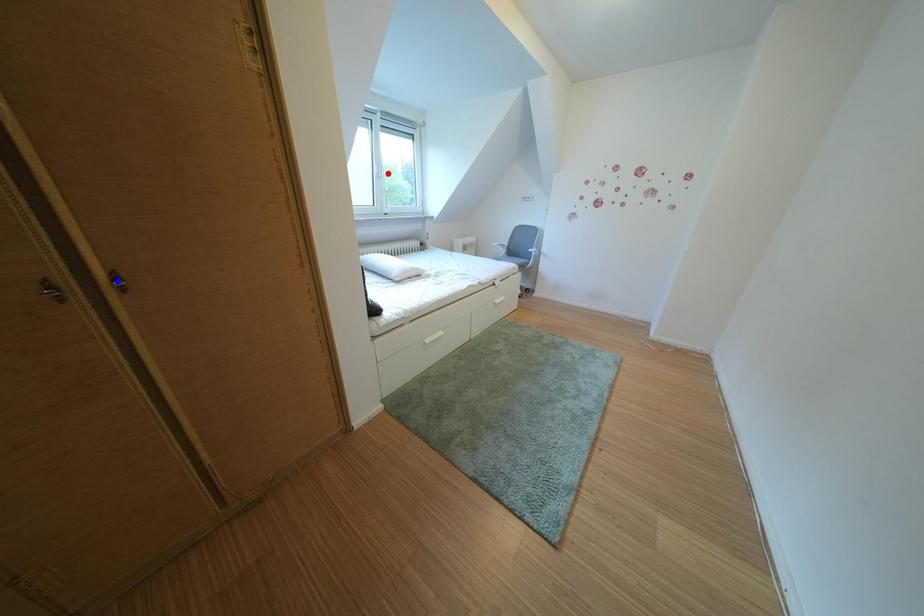
Question: Which of the two points in the image is closer to the camera?

Choices:
 (A) Blue point is closer.
 (B) Red point is closer.

Answer: (A)